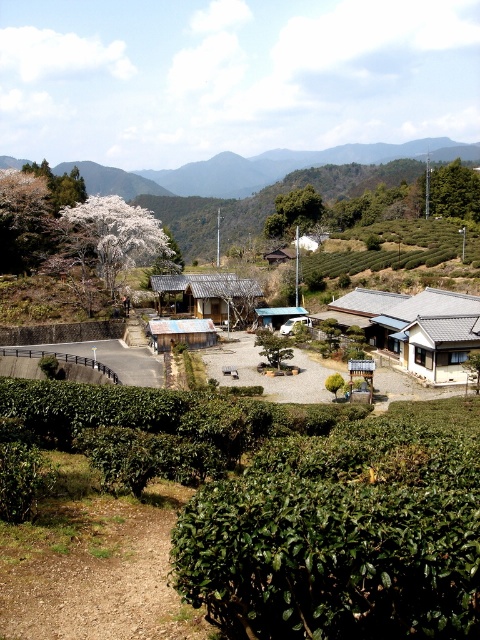
Question: Which point is closer to the camera taking this photo?

Choices:
 (A) (158, 280)
 (B) (208, 333)
 (C) (386, 156)

Answer: (B)

Question: Estimate the real-world distances between objects in this image. Which object is farther from the wooden hut at center?

Choices:
 (A) metallic blue hut at center
 (B) white tiled roof house at center-right

Answer: (B)

Question: From the image, what is the correct spatial relationship of green grassy hillside at upper left in relation to white tiled roof house at center-right?

Choices:
 (A) above
 (B) below

Answer: (A)

Question: Is white tiled roof house at center-right to the left of green leafy tree at center from the viewer's perspective?

Choices:
 (A) no
 (B) yes

Answer: (A)

Question: Among these points, which one is nearest to the camera?

Choices:
 (A) (409, 346)
 (B) (279, 316)
 (C) (230, 282)

Answer: (A)

Question: Is the position of green leafy tree at upper center less distant than that of wooden hut at center?

Choices:
 (A) no
 (B) yes

Answer: (A)